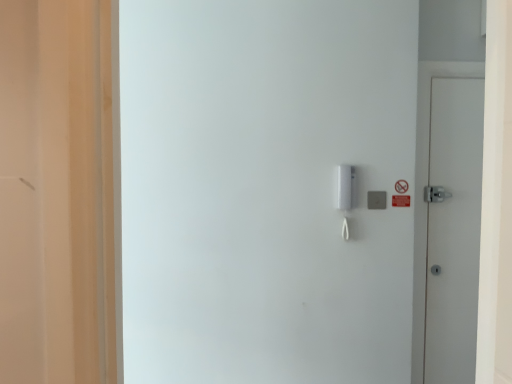
Question: Based on their sizes in the image, would you say white plastic intercom at center-right is bigger or smaller than white matte door at right?

Choices:
 (A) big
 (B) small

Answer: (A)

Question: From their relative heights in the image, would you say white plastic intercom at center-right is taller or shorter than white matte door at right?

Choices:
 (A) tall
 (B) short

Answer: (B)

Question: Which of these objects is positioned farthest from the white plastic intercom at center-right?

Choices:
 (A) gray matte/light switch at center-right
 (B) white matte door at right

Answer: (A)

Question: Estimate the real-world distances between objects in this image. Which object is farther from the gray matte/light switch at center-right?

Choices:
 (A) white matte door at right
 (B) white plastic intercom at center-right

Answer: (B)